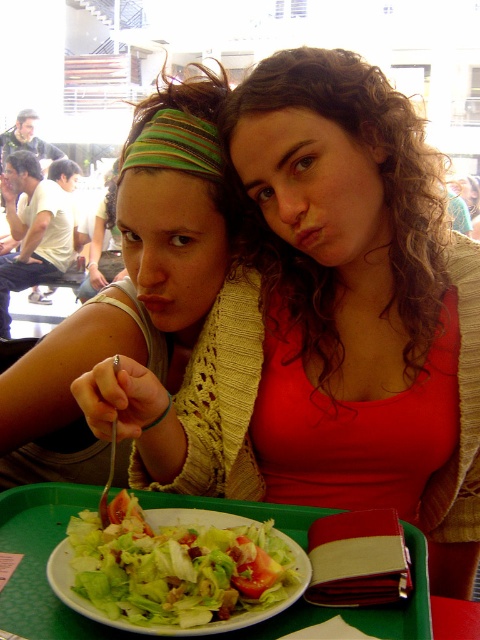
Question: Is matte yellow scarf at center bigger than matte green headband at center?

Choices:
 (A) no
 (B) yes

Answer: (B)

Question: Which of the following is the farthest from the observer?

Choices:
 (A) matte yellow scarf at center
 (B) green plastic tray at center
 (C) green leafy salad at center
 (D) matte green headband at center

Answer: (D)

Question: In this image, where is matte yellow scarf at center located relative to matte green headband at center?

Choices:
 (A) left
 (B) right

Answer: (B)

Question: Which point is farther to the camera?

Choices:
 (A) (310, 298)
 (B) (406, 611)

Answer: (A)

Question: Is matte yellow scarf at center below green leafy salad at center?

Choices:
 (A) no
 (B) yes

Answer: (A)

Question: Which point appears farthest from the camera in this image?

Choices:
 (A) (231, 499)
 (B) (322, 310)
 (C) (223, 90)
 (D) (158, 609)

Answer: (C)